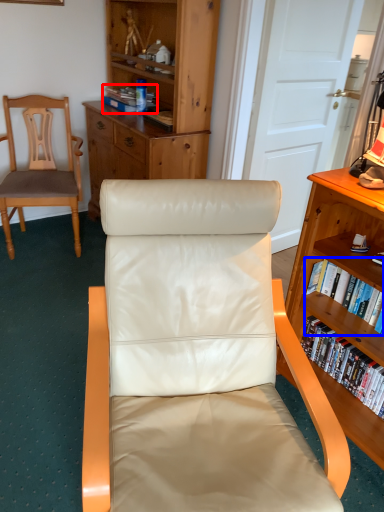
Question: Among these objects, which one is farthest to the camera, book (highlighted by a red box) or book (highlighted by a blue box)?

Choices:
 (A) book
 (B) book

Answer: (A)